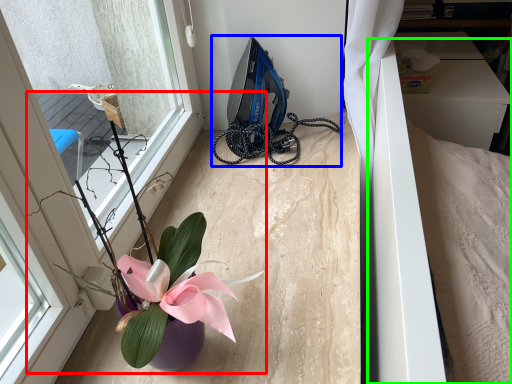
Question: Which is farther away from houseplant (highlighted by a red box)? equipment (highlighted by a blue box) or bed (highlighted by a green box)?

Choices:
 (A) equipment
 (B) bed

Answer: (A)